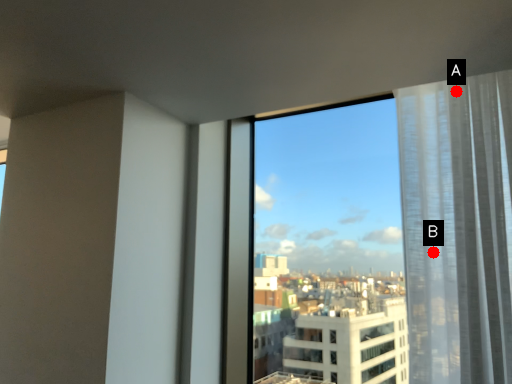
Question: Two points are circled on the image, labeled by A and B beside each circle. Among these points, which one is nearest to the camera?

Choices:
 (A) A is closer
 (B) B is closer

Answer: (B)